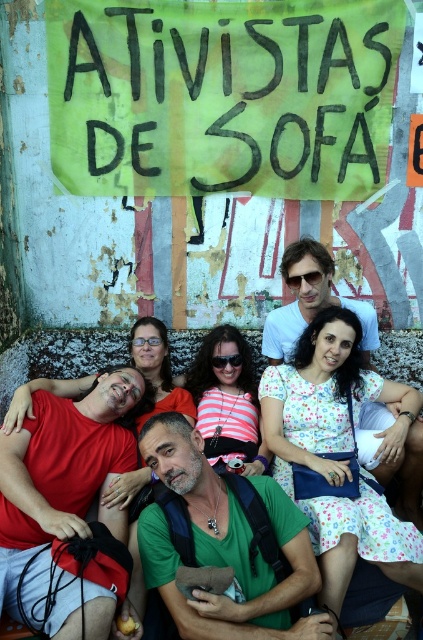
Question: Which point is farther from the camera taking this photo?

Choices:
 (A) (54, 625)
 (B) (280, 54)
 (C) (261, 621)
 (D) (393, 416)

Answer: (B)

Question: Which point is farther from the camera taking this photo?

Choices:
 (A) (10, 454)
 (B) (419, 449)
 (C) (313, 572)
 (D) (180, 132)

Answer: (D)

Question: Observing the image, what is the correct spatial positioning of green painted cardboard sign at upper center in reference to green fabric shirt at center?

Choices:
 (A) above
 (B) below

Answer: (A)

Question: Does matte red t-shirt at center have a smaller size compared to green fabric shirt at center?

Choices:
 (A) no
 (B) yes

Answer: (A)

Question: Based on their relative distances, which object is nearer to the green painted cardboard sign at upper center?

Choices:
 (A) matte white shirt at center
 (B) green fabric shirt at center

Answer: (A)

Question: Is green painted cardboard sign at upper center wider than green fabric shirt at center?

Choices:
 (A) yes
 (B) no

Answer: (A)